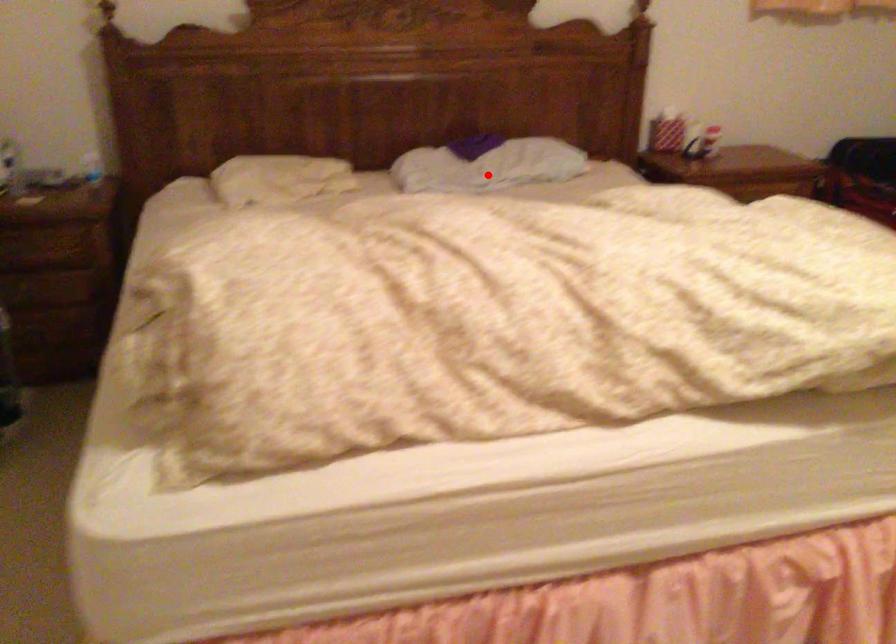
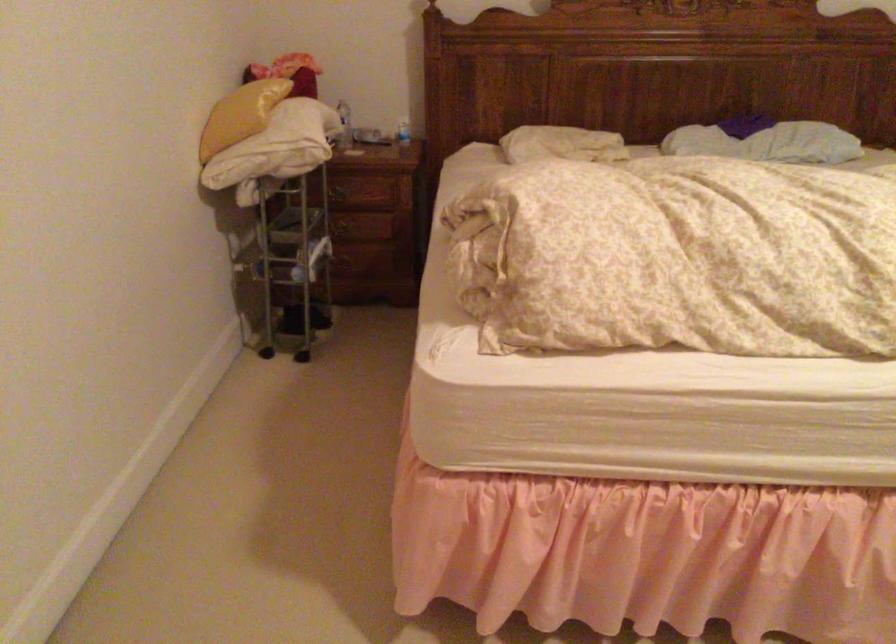
In the second image, find the point that corresponds to the highlighted location in the first image.

(767, 142)